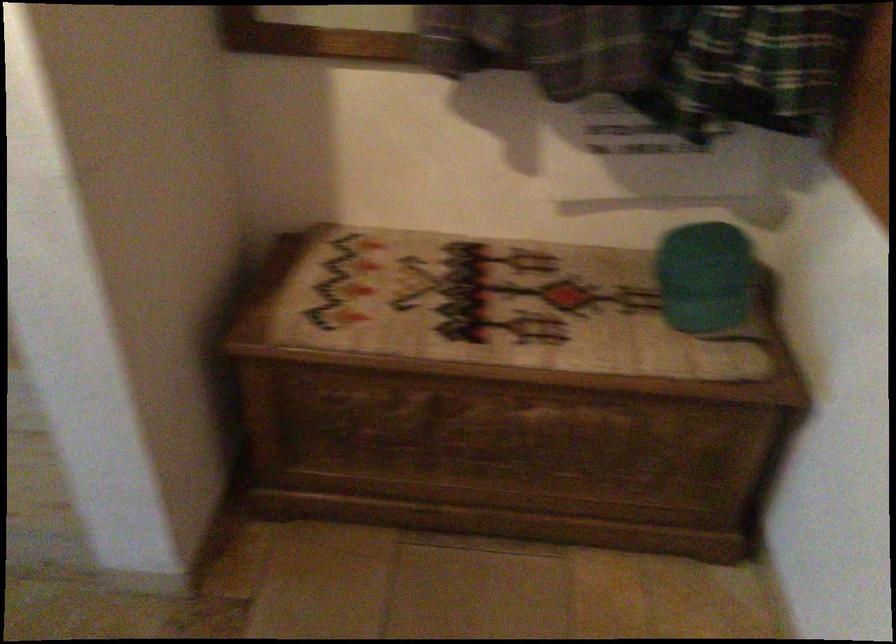
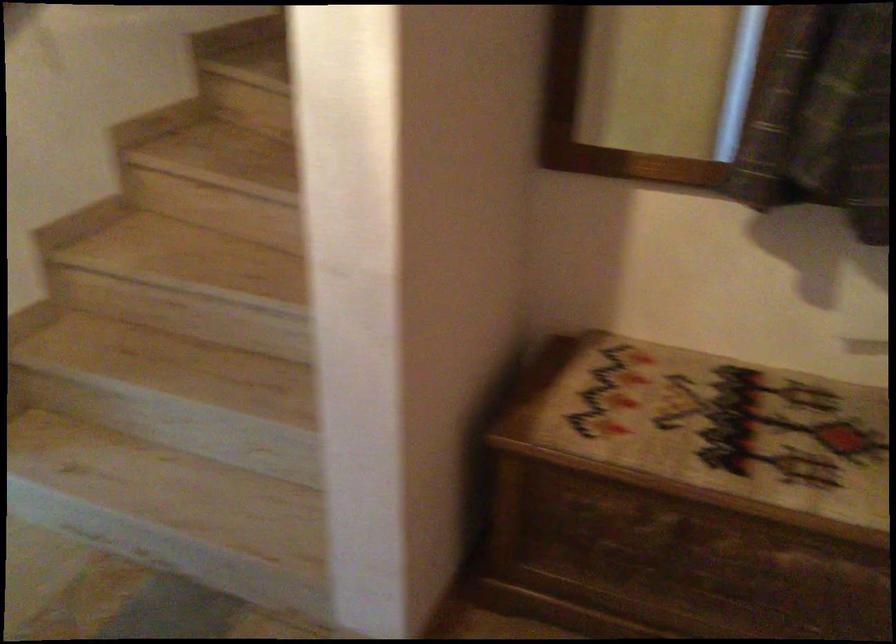
Find the pixel in the second image that matches pixel 445 307 in the first image.

(709, 431)